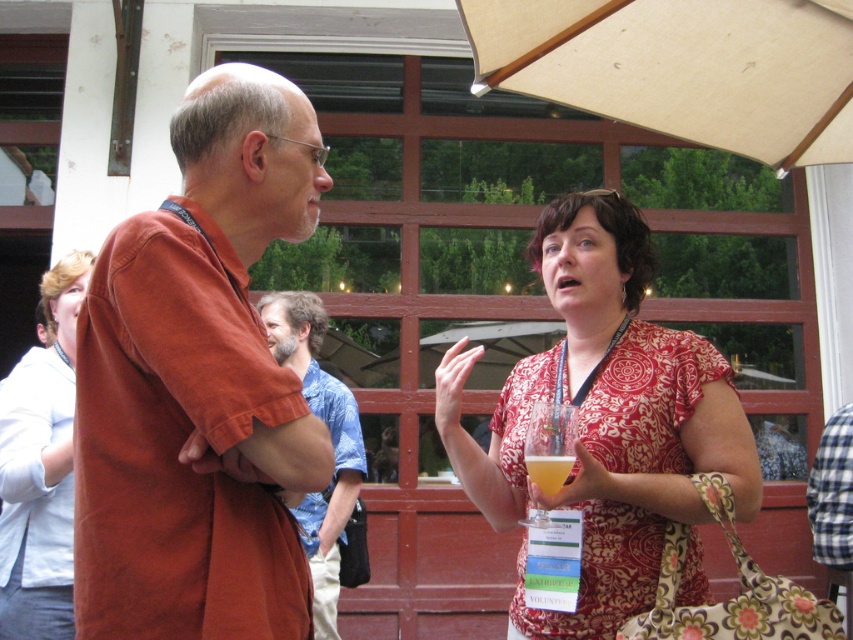
You are organizing a clothing display and need to arrange the matte orange shirt at center and the blue floral shirt at center on a shelf. Given their sizes, which shirt should be placed on the left side of the shelf to ensure both fit properly?

The matte orange shirt at center occupies less space than the blue floral shirt at center, so placing the smaller matte orange shirt at center on the left allows the larger blue floral shirt at center to fit on the right side of the shelf.

You are organizing a clothing display and need to stack the matte orange shirt at center and the blue floral shirt at center vertically. Which shirt should you place at the bottom to ensure stability?

The matte orange shirt at center is thinner than the blue floral shirt at center, so placing the thicker blue floral shirt at center at the bottom would provide better stability for the stack.

You are organizing a photo shoot and need to arrange two models wearing the patterned fabric dress at center and the blue floral shirt at center. Based on their height difference, which model should stand in front to ensure both are visible in the photo?

The patterned fabric dress at center has a lesser height compared to blue floral shirt at center, so the model wearing the patterned fabric dress at center should stand in front to ensure both are visible.